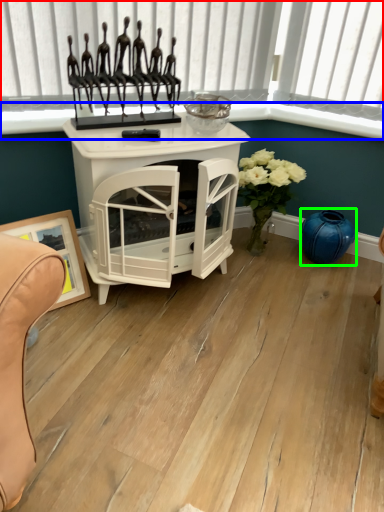
Question: Which object is positioned closest to window frame (highlighted by a red box)? Select from window sill (highlighted by a blue box) and vase (highlighted by a green box).

Choices:
 (A) window sill
 (B) vase

Answer: (A)